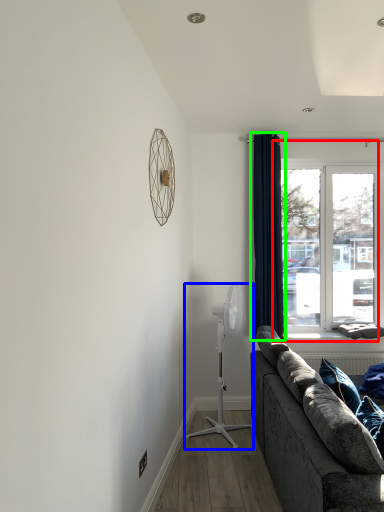
Question: Which object is positioned closest to window (highlighted by a red box)? Select from mechanical fan (highlighted by a blue box) and curtain (highlighted by a green box).

Choices:
 (A) mechanical fan
 (B) curtain

Answer: (B)